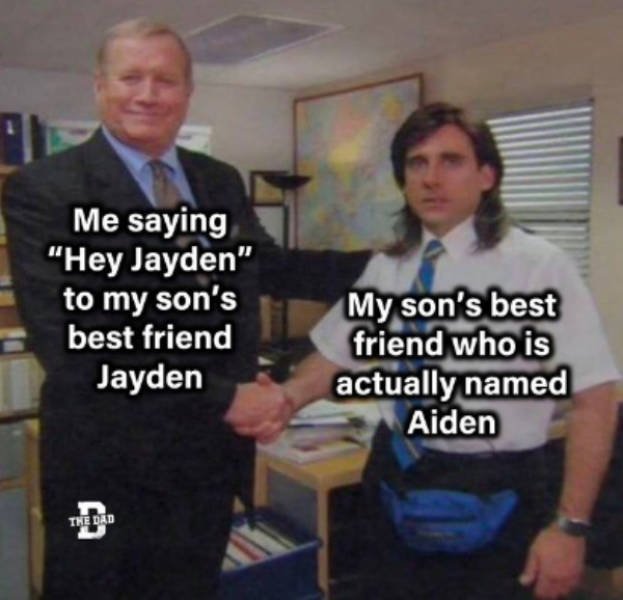
Find the location of a particular element. This screenshot has width=623, height=600. wooden desk is located at coordinates (316, 468).